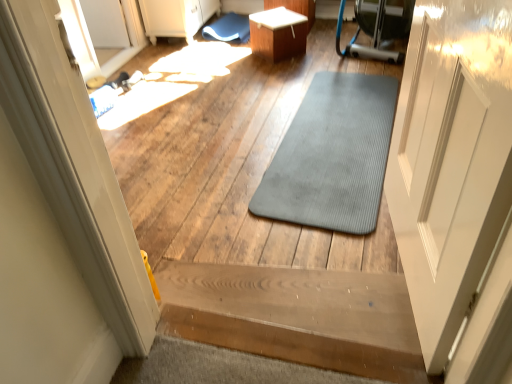
Find the location of a particular element. The height and width of the screenshot is (384, 512). free space to the left of gray rubber mat at center is located at coordinates (206, 137).